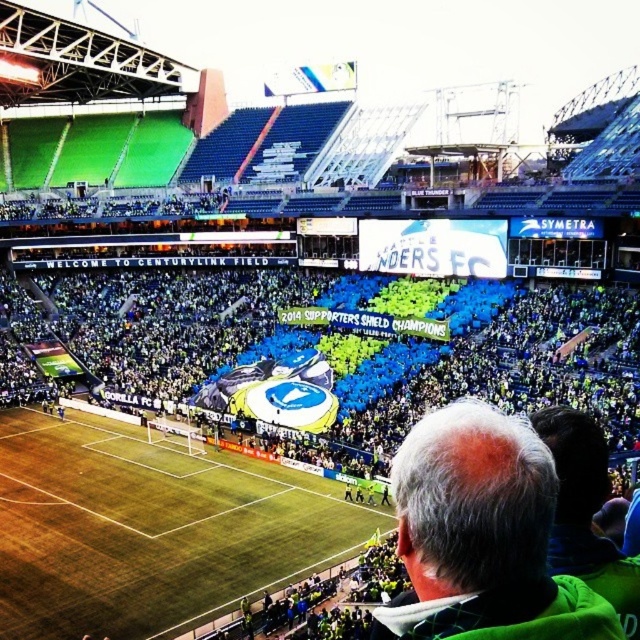
Based on the scene at CenturyLink Field, where is the green fabric located in relation to the point marked at coordinates (586, 513)?

The green fabric at lower right is located at the coordinates point (586, 513).

You are standing at the entrance of CenturyLink Field and want to reach a specific point marked at coordinates point (170, 570). If your walking speed is 3 feet per second, how many seconds will it take you to reach that point?

The distance of point (170, 570) from viewer is 201.87 feet. At a speed of 3 feet per second, it would take approximately 67.3 seconds to reach the point.

You are a drone operator trying to capture aerial footage of the soccer match at CenturyLink Field. Your drone is currently hovering above the point marked at coordinate [150,529]. Based on the scene description, what is the primary object directly below this coordinate?

The point marked at coordinate [150,529] is directly above the green grass football field at center, which is the primary object below this coordinate.